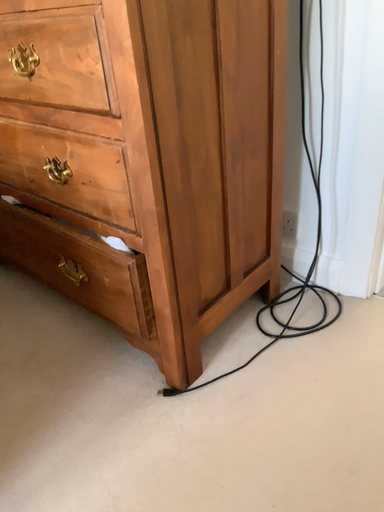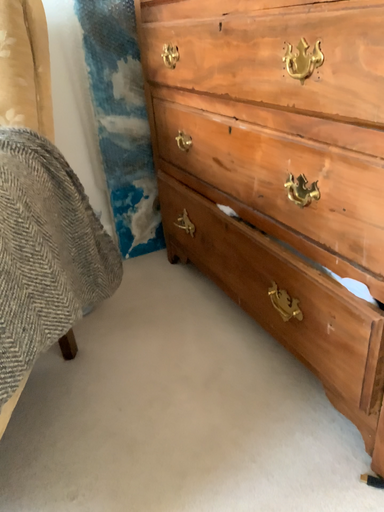
Question: Which way did the camera rotate in the video?

Choices:
 (A) rotated right
 (B) rotated left

Answer: (B)